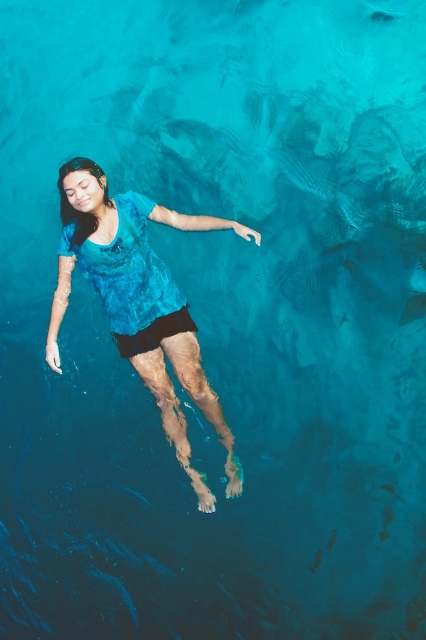
Is blue fabric shirt at center behind black matte shorts at center?

No, blue fabric shirt at center is closer to the viewer.

Where is `blue fabric shirt at center`? This screenshot has width=426, height=640. blue fabric shirt at center is located at coordinates (x=138, y=300).

This screenshot has width=426, height=640. Identify the location of blue fabric shirt at center. (138, 300).